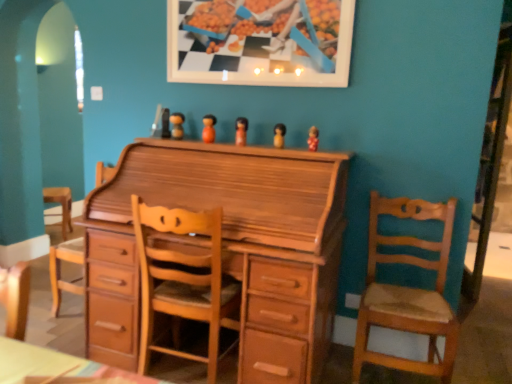
Where is `free location to the left of orange matte wooden doll at center, which is the 4th toy from right to left`? The height and width of the screenshot is (384, 512). free location to the left of orange matte wooden doll at center, which is the 4th toy from right to left is located at coordinates (181, 141).